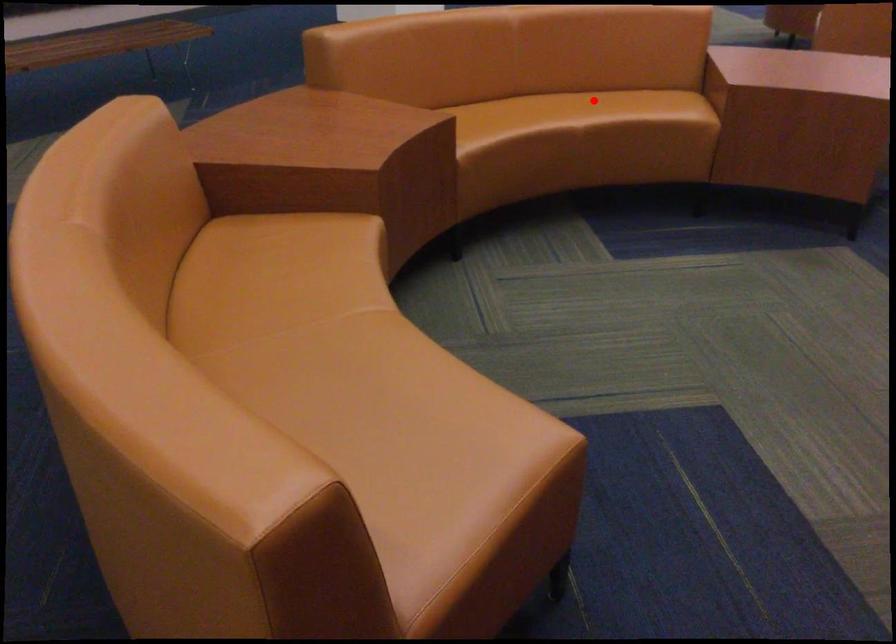
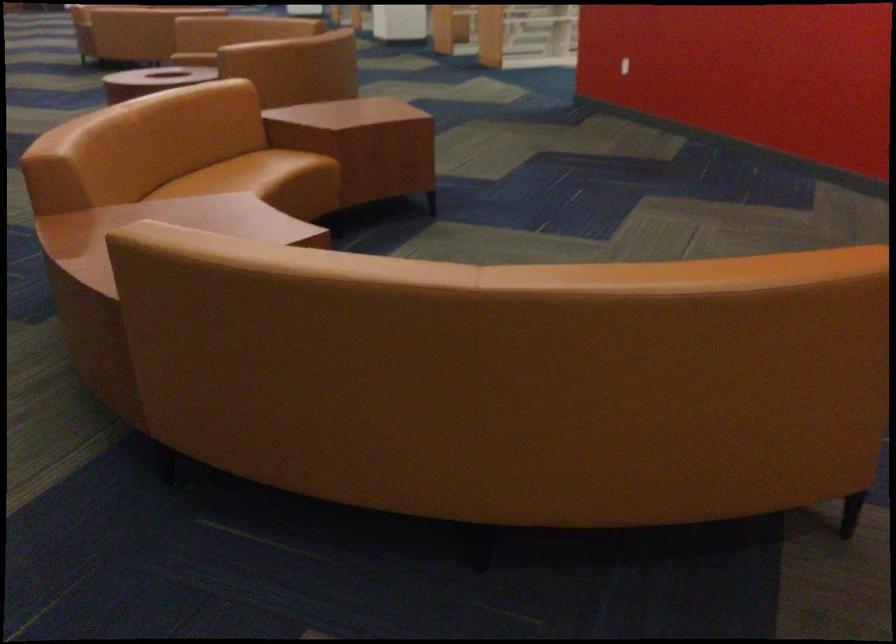
Question: I am providing you with two images of the same scene from different viewpoints. Image1 has a red point marked. In image2, the corresponding 3D location appears at what relative position? Reply with the corresponding letter.

Choices:
 (A) Closer
 (B) Farther

Answer: (B)